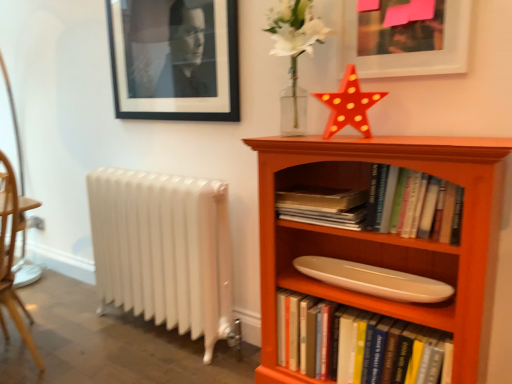
Identify the location of wooden chair at left. (11, 254).

Identify the location of white metallic radiator at lower left. This screenshot has width=512, height=384. (164, 250).

Describe the element at coordinates (385, 236) in the screenshot. I see `orange wood bookcase at right` at that location.

In order to face orange wood bookcase at right, should I rotate leftwards or rightwards?

A 14.610 degree turn to the right will do.

Where is `hardcover book at center, positioned as the first book in top-to-bottom order`? hardcover book at center, positioned as the first book in top-to-bottom order is located at coordinates 323,206.

Measure the distance between point (161,106) and camera.

Point (161,106) and camera are 6.89 feet apart.

This screenshot has height=384, width=512. I want to click on wooden chair at left, so click(x=11, y=254).

Image resolution: width=512 pixels, height=384 pixels. I want to click on picture frame behind the white glossy bookshelf at center, the 2th book from the top, so click(x=174, y=59).

Consider the image. Who is shorter, black matte picture frame at upper left, which ranks as the 1th picture frame in back-to-front order, or white glossy bookshelf at center, the 2th book from the top?

white glossy bookshelf at center, the 2th book from the top, is shorter.

Is point (229, 44) closer or farther from the camera than point (422, 368)?

Point (229, 44).

Considering the sizes of objects black matte picture frame at upper left, arranged as the 1th picture frame when viewed from the left, and white glossy bookshelf at center, placed as the 1th book when sorted from bottom to top, in the image provided, who is bigger, black matte picture frame at upper left, arranged as the 1th picture frame when viewed from the left, or white glossy bookshelf at center, placed as the 1th book when sorted from bottom to top,?

white glossy bookshelf at center, placed as the 1th book when sorted from bottom to top, is bigger.

Does point (318, 311) appear closer or farther from the camera than point (10, 235)?

Point (318, 311) is closer to the camera than point (10, 235).

Is white glossy bookshelf at center, placed as the 1th book when sorted from bottom to top, facing away from wooden chair at left?

No, wooden chair at left is not at the back of white glossy bookshelf at center, placed as the 1th book when sorted from bottom to top.

How much distance is there between white glossy bookshelf at center, placed as the 1th book when sorted from bottom to top, and wooden chair at left?

4.61 feet.

Is there a large distance between white glossy bookshelf at center, the 2th book from the top, and wooden chair at left?

white glossy bookshelf at center, the 2th book from the top, is positioned a significant distance from wooden chair at left.

Is hardcover book at center, which is the 2th book in bottom-to-top order, looking in the opposite direction of white glossy bookshelf at center, placed as the 1th book when sorted from bottom to top?

hardcover book at center, which is the 2th book in bottom-to-top order, does not have its back to white glossy bookshelf at center, placed as the 1th book when sorted from bottom to top.

Considering the positions of point (339, 220) and point (283, 316), is point (339, 220) closer or farther from the camera than point (283, 316)?

Point (339, 220) is closer to the camera than point (283, 316).

From a real-world perspective, is hardcover book at center, which is the 2th book in bottom-to-top order, above or below white glossy bookshelf at center, the 2th book from the top?

From a real-world perspective, hardcover book at center, which is the 2th book in bottom-to-top order, is physically above white glossy bookshelf at center, the 2th book from the top.

Can you confirm if hardcover book at center, positioned as the first book in top-to-bottom order, is thinner than black matte picture frame at upper left, arranged as the 1th picture frame when viewed from the left?

Incorrect, the width of hardcover book at center, positioned as the first book in top-to-bottom order, is not less than that of black matte picture frame at upper left, arranged as the 1th picture frame when viewed from the left.

What's the angular difference between hardcover book at center, positioned as the first book in top-to-bottom order, and black matte picture frame at upper left, which ranks as the 2th picture frame in right-to-left order,'s facing directions?

0.00185 degrees.

Considering the relative sizes of hardcover book at center, which is the 2th book in bottom-to-top order, and black matte picture frame at upper left, which ranks as the 1th picture frame in back-to-front order, in the image provided, is hardcover book at center, which is the 2th book in bottom-to-top order, taller than black matte picture frame at upper left, which ranks as the 1th picture frame in back-to-front order,?

No.

The height and width of the screenshot is (384, 512). In order to click on picture frame that appears behind the hardcover book at center, positioned as the first book in top-to-bottom order in this screenshot , I will do `click(174, 59)`.

Is shiny plastic star at upper center wider than white glossy bookshelf at center, placed as the 1th book when sorted from bottom to top?

No, shiny plastic star at upper center is not wider than white glossy bookshelf at center, placed as the 1th book when sorted from bottom to top.

From the image's perspective, which one is positioned lower, shiny plastic star at upper center or white glossy bookshelf at center, the 2th book from the top?

white glossy bookshelf at center, the 2th book from the top, appears lower in the image.

Considering their positions, is shiny plastic star at upper center located in front of or behind white glossy bookshelf at center, the 2th book from the top?

Visually, shiny plastic star at upper center is located behind white glossy bookshelf at center, the 2th book from the top.

At what (x,y) coordinates should I click in order to perform the action: click on chiffonier above the white glossy bookshelf at center, the 2th book from the top (from the image's perspective). Please return your answer as a coordinate pair (x, y). Looking at the image, I should click on (349, 105).

Is wooden chair at left surrounded by orange wood bookcase at right?

That's incorrect, wooden chair at left is not inside orange wood bookcase at right.

How many degrees apart are the facing directions of orange wood bookcase at right and wooden chair at left?

The angle between the facing direction of orange wood bookcase at right and the facing direction of wooden chair at left is 3.41e-05 degrees.

From a real-world perspective, does orange wood bookcase at right sit lower than wooden chair at left?

No, from a real-world perspective, orange wood bookcase at right is not beneath wooden chair at left.

Consider the image. Does orange wood bookcase at right turn towards wooden chair at left?

No.

Is white metallic radiator at lower left not within matte white picture frame at upper right, which is the 2th picture frame in back-to-front order?

That's correct, white metallic radiator at lower left is outside of matte white picture frame at upper right, which is the 2th picture frame in back-to-front order.

Does white metallic radiator at lower left have a greater width compared to matte white picture frame at upper right, positioned as the first picture frame in front-to-back order?

Yes.

From the image's perspective, is white metallic radiator at lower left above or below matte white picture frame at upper right, positioned as the first picture frame in front-to-back order?

white metallic radiator at lower left is below matte white picture frame at upper right, positioned as the first picture frame in front-to-back order.

Which point is more forward, (x=191, y=223) or (x=377, y=58)?

The point (x=377, y=58) is closer.

From a real-world perspective, count 1st picture frames upward from the white glossy bookshelf at center, the 2th book from the top, and point to it. Please provide its 2D coordinates.

[(174, 59)]

Where is `chair behind the white glossy bookshelf at center, the 2th book from the top`? chair behind the white glossy bookshelf at center, the 2th book from the top is located at coordinates (11, 254).

When comparing their distances from white metallic radiator at lower left, does shiny plastic star at upper center or white glossy bookshelf at center, the 2th book from the top, seem closer?

white glossy bookshelf at center, the 2th book from the top, lies closer to white metallic radiator at lower left than the other object.

From the image, which object appears to be nearer to matte white picture frame at upper right, positioned as the first picture frame in front-to-back order, black matte picture frame at upper left, arranged as the 1th picture frame when viewed from the left, or shiny plastic star at upper center?

shiny plastic star at upper center lies closer to matte white picture frame at upper right, positioned as the first picture frame in front-to-back order, than the other object.

When comparing their distances from matte white picture frame at upper right, which is the 2th picture frame in back-to-front order, does black matte picture frame at upper left, arranged as the 1th picture frame when viewed from the left, or orange wood bookcase at right seem closer?

Based on the image, orange wood bookcase at right appears to be nearer to matte white picture frame at upper right, which is the 2th picture frame in back-to-front order.

Estimate the real-world distances between objects in this image. Which object is closer to shiny plastic star at upper center, white metallic radiator at lower left or white glossy bookshelf at center, placed as the 1th book when sorted from bottom to top?

Based on the image, white glossy bookshelf at center, placed as the 1th book when sorted from bottom to top, appears to be nearer to shiny plastic star at upper center.

Based on their spatial positions, is shiny plastic star at upper center or black matte picture frame at upper left, the second picture frame positioned from the front, closer to orange wood bookcase at right?

shiny plastic star at upper center is positioned closer to the anchor orange wood bookcase at right.

Based on their spatial positions, is shiny plastic star at upper center or orange wood bookcase at right closer to white metallic radiator at lower left?

Among the two, orange wood bookcase at right is located nearer to white metallic radiator at lower left.

Based on their spatial positions, is matte white picture frame at upper right, the second picture frame in the left-to-right sequence, or wooden chair at left closer to black matte picture frame at upper left, which ranks as the 1th picture frame in back-to-front order?

The object closer to black matte picture frame at upper left, which ranks as the 1th picture frame in back-to-front order, is matte white picture frame at upper right, the second picture frame in the left-to-right sequence.

Considering their positions, is white glossy surfboard at center positioned closer to white metallic radiator at lower left than shiny plastic star at upper center?

white glossy surfboard at center lies closer to white metallic radiator at lower left than the other object.

Identify the location of picture frame that lies between black matte picture frame at upper left, arranged as the 1th picture frame when viewed from the left, and orange wood bookcase at right from top to bottom. (406, 41).

You are a GUI agent. You are given a task and a screenshot of the screen. Output one action in this format:
    pyautogui.click(x=<x>, y=<y>)
    Task: Click on the shelf between black matte picture frame at upper left, which ranks as the 2th picture frame in right-to-left order, and orange wood bookcase at right from top to bottom
    
    Given the screenshot: What is the action you would take?
    pyautogui.click(x=368, y=264)

I want to click on picture frame between wooden chair at left and hardcover book at center, which is the 2th book in bottom-to-top order, from left to right, so click(x=174, y=59).

Find the location of a particular element. radiator between wooden chair at left and matte white picture frame at upper right, acting as the 1th picture frame starting from the right, in the horizontal direction is located at coordinates (164, 250).